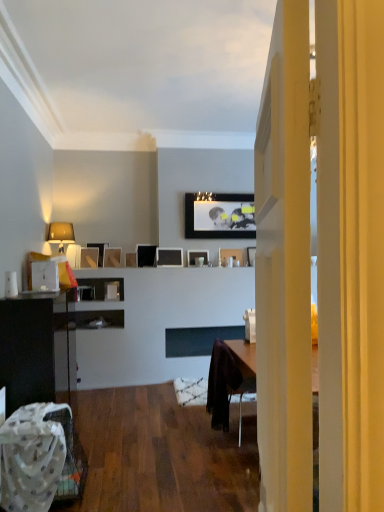
Question: In which direction should I rotate to look at matte black picture frame at upper center, the fifth picture frame viewed from the left?

Choices:
 (A) left
 (B) right

Answer: (A)

Question: Does matte black picture frame at upper center, the first picture frame from the right, have a greater width compared to matte beige lampshade at left?

Choices:
 (A) no
 (B) yes

Answer: (A)

Question: Are matte black picture frame at upper center, marked as the 10th picture frame in a left-to-right arrangement, and matte beige lampshade at left beside each other?

Choices:
 (A) no
 (B) yes

Answer: (A)

Question: Is matte beige lampshade at left located within matte black picture frame at upper center, the first picture frame from the right?

Choices:
 (A) no
 (B) yes

Answer: (A)

Question: Considering the relative sizes of matte black picture frame at upper center, marked as the 10th picture frame in a left-to-right arrangement, and matte beige lampshade at left in the image provided, is matte black picture frame at upper center, marked as the 10th picture frame in a left-to-right arrangement, thinner than matte beige lampshade at left?

Choices:
 (A) yes
 (B) no

Answer: (A)

Question: Is matte black picture frame at upper center, marked as the 10th picture frame in a left-to-right arrangement, shorter than matte beige lampshade at left?

Choices:
 (A) yes
 (B) no

Answer: (A)

Question: Is matte black picture frame at upper center, the first picture frame from the right, smaller than matte beige lampshade at left?

Choices:
 (A) no
 (B) yes

Answer: (B)

Question: From a real-world perspective, is matte beige lampshade at left over matte black cabinet at left?

Choices:
 (A) no
 (B) yes

Answer: (B)

Question: Does matte beige lampshade at left have a lesser width compared to matte black cabinet at left?

Choices:
 (A) yes
 (B) no

Answer: (A)

Question: Is matte beige lampshade at left surrounding matte black cabinet at left?

Choices:
 (A) no
 (B) yes

Answer: (A)

Question: Is matte beige lampshade at left oriented towards matte black cabinet at left?

Choices:
 (A) no
 (B) yes

Answer: (A)

Question: Considering the relative sizes of matte beige lampshade at left and matte black cabinet at left in the image provided, is matte beige lampshade at left taller than matte black cabinet at left?

Choices:
 (A) yes
 (B) no

Answer: (B)

Question: From a real-world perspective, does matte beige lampshade at left sit lower than matte black cabinet at left?

Choices:
 (A) no
 (B) yes

Answer: (A)

Question: Is matte black picture frame at upper center, the fifth picture frame viewed from the left, shorter than matte black picture frame at upper center, which is the 8th picture frame from right to left?

Choices:
 (A) yes
 (B) no

Answer: (B)